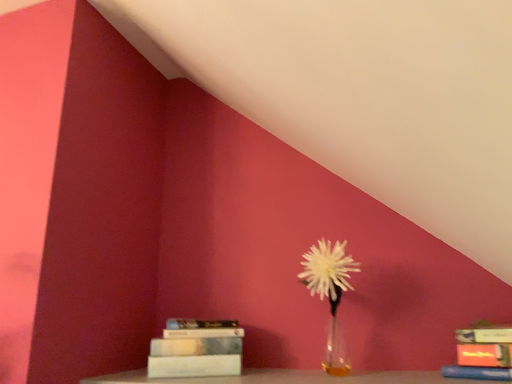
Find the location of a particular element. translucent glass vase at center is located at coordinates (288, 378).

This screenshot has width=512, height=384. What do you see at coordinates (330, 294) in the screenshot?
I see `white glass vase at center` at bounding box center [330, 294].

This screenshot has width=512, height=384. In order to click on white glass vase at center in this screenshot , I will do `click(330, 294)`.

What do you see at coordinates (482, 353) in the screenshot?
I see `hardcover book at lower right, acting as the second book starting from the back` at bounding box center [482, 353].

I want to click on hardcover book at lower right, marked as the 1th book in a front-to-back arrangement, so click(482, 353).

Image resolution: width=512 pixels, height=384 pixels. Find the location of `translucent glass vase at center`. translucent glass vase at center is located at coordinates (288, 378).

Is translucent glass vase at center aimed at hardcover book at lower right, acting as the second book starting from the back?

No, translucent glass vase at center is not turned towards hardcover book at lower right, acting as the second book starting from the back.

Considering the relative sizes of translucent glass vase at center and hardcover book at lower right, which is the second book from left to right, in the image provided, is translucent glass vase at center wider than hardcover book at lower right, which is the second book from left to right,?

Yes.

From the image's perspective, is translucent glass vase at center located above or below hardcover book at lower right, marked as the 1th book in a front-to-back arrangement?

translucent glass vase at center is situated lower than hardcover book at lower right, marked as the 1th book in a front-to-back arrangement, in the image.

Is translucent glass vase at center inside the boundaries of hardcover book at lower right, marked as the 1th book in a front-to-back arrangement, or outside?

translucent glass vase at center exists outside the volume of hardcover book at lower right, marked as the 1th book in a front-to-back arrangement.

From their relative heights in the image, would you say white glass vase at center is taller or shorter than translucent glass vase at center?

In the image, white glass vase at center appears to be taller than translucent glass vase at center.

Does white glass vase at center come behind translucent glass vase at center?

Yes, it is behind translucent glass vase at center.

From a real-world perspective, between white glass vase at center and translucent glass vase at center, who is vertically lower?

translucent glass vase at center, from a real-world perspective.

Measure the distance from hardcover book at lower right, which appears as the 1th book when viewed from the right, to translucent glass vase at center.

They are 7.74 inches apart.

Who is shorter, hardcover book at lower right, which is the second book from left to right, or translucent glass vase at center?

With less height is translucent glass vase at center.

From a real-world perspective, which is physically above, hardcover book at lower right, marked as the 1th book in a front-to-back arrangement, or translucent glass vase at center?

In real-world perspective, hardcover book at lower right, marked as the 1th book in a front-to-back arrangement, is above.

Based on their sizes in the image, would you say hardcover book at lower right, which appears as the 1th book when viewed from the right, is bigger or smaller than translucent glass vase at center?

Clearly, hardcover book at lower right, which appears as the 1th book when viewed from the right, is smaller in size than translucent glass vase at center.

Measure the distance between translucent glass vase at center and hardcover book at lower left, positioned as the second book in front-to-back order.

They are 4.84 inches apart.

Is translucent glass vase at center not within hardcover book at lower left, the first book from the left?

Indeed, translucent glass vase at center is completely outside hardcover book at lower left, the first book from the left.

Which of these two, translucent glass vase at center or hardcover book at lower left, the 2th book from the right, is bigger?

translucent glass vase at center.

Locate an element on the screen. furniture below the hardcover book at lower left, the 1th book positioned from the back (from the image's perspective) is located at coordinates (288, 378).

From the image's perspective, which is above, translucent glass vase at center or white glass vase at center?

white glass vase at center, from the image's perspective.

Can we say translucent glass vase at center lies outside white glass vase at center?

That's correct, translucent glass vase at center is outside of white glass vase at center.

Is translucent glass vase at center oriented away from white glass vase at center?

No.

Can you tell me how much translucent glass vase at center and white glass vase at center differ in facing direction?

The angular difference between translucent glass vase at center and white glass vase at center is 1.06 degrees.

Who is bigger, hardcover book at lower left, positioned as the second book in front-to-back order, or translucent glass vase at center?

With larger size is translucent glass vase at center.

Would you say hardcover book at lower left, the first book from the left, is inside or outside translucent glass vase at center?

hardcover book at lower left, the first book from the left, is not enclosed by translucent glass vase at center.

Can you confirm if hardcover book at lower left, positioned as the second book in front-to-back order, is shorter than translucent glass vase at center?

In fact, hardcover book at lower left, positioned as the second book in front-to-back order, may be taller than translucent glass vase at center.

Which object is closer to the camera, hardcover book at lower left, the 2th book from the right, or translucent glass vase at center?

translucent glass vase at center is closer to the camera.

From a real-world perspective, is hardcover book at lower left, the 1th book positioned from the back, positioned above or below hardcover book at lower right, which appears as the 1th book when viewed from the right?

From a real-world perspective, hardcover book at lower left, the 1th book positioned from the back, is physically above hardcover book at lower right, which appears as the 1th book when viewed from the right.

Are hardcover book at lower left, positioned as the second book in front-to-back order, and hardcover book at lower right, which appears as the 1th book when viewed from the right, beside each other?

They are not placed beside each other.

Which is in front, point (234, 321) or point (485, 350)?

The point (485, 350) is more forward.

Identify the location of furniture below the hardcover book at lower right, which appears as the 1th book when viewed from the right (from the image's perspective). The width and height of the screenshot is (512, 384). (288, 378).

Where is `floral arrangement that is on the right side of translucent glass vase at center`? The height and width of the screenshot is (384, 512). floral arrangement that is on the right side of translucent glass vase at center is located at coordinates (330, 294).

Which object lies further to the anchor point hardcover book at lower right, acting as the second book starting from the back, white glass vase at center or translucent glass vase at center?

white glass vase at center is positioned further to the anchor hardcover book at lower right, acting as the second book starting from the back.

Considering their positions, is hardcover book at lower left, the first book from the left, positioned closer to translucent glass vase at center than white glass vase at center?

hardcover book at lower left, the first book from the left, is positioned closer to the anchor translucent glass vase at center.

When comparing their distances from hardcover book at lower left, positioned as the second book in front-to-back order, does translucent glass vase at center or hardcover book at lower right, which appears as the 1th book when viewed from the right, seem further?

The object further to hardcover book at lower left, positioned as the second book in front-to-back order, is hardcover book at lower right, which appears as the 1th book when viewed from the right.

Based on their spatial positions, is white glass vase at center or hardcover book at lower right, marked as the 1th book in a front-to-back arrangement, closer to translucent glass vase at center?

hardcover book at lower right, marked as the 1th book in a front-to-back arrangement, is closer to translucent glass vase at center.

From the picture: Considering their positions, is white glass vase at center positioned closer to translucent glass vase at center than hardcover book at lower left, positioned as the second book in front-to-back order?

Based on the image, hardcover book at lower left, positioned as the second book in front-to-back order, appears to be nearer to translucent glass vase at center.

Looking at the image, which one is located further to white glass vase at center, hardcover book at lower right, which is the second book from left to right, or translucent glass vase at center?

Among the two, hardcover book at lower right, which is the second book from left to right, is located further to white glass vase at center.

Based on their spatial positions, is translucent glass vase at center or hardcover book at lower right, acting as the second book starting from the back, further from white glass vase at center?

hardcover book at lower right, acting as the second book starting from the back, is positioned further to the anchor white glass vase at center.

Looking at this image, considering their positions, is hardcover book at lower left, the 1th book positioned from the back, positioned closer to hardcover book at lower right, acting as the second book starting from the back, than white glass vase at center?

white glass vase at center is positioned closer to the anchor hardcover book at lower right, acting as the second book starting from the back.

I want to click on floral arrangement situated between translucent glass vase at center and hardcover book at lower right, marked as the 1th book in a front-to-back arrangement, from left to right, so click(330, 294).

I want to click on furniture between hardcover book at lower left, the 2th book from the right, and white glass vase at center, so click(288, 378).

Where is `furniture between hardcover book at lower left, the 1th book positioned from the back, and hardcover book at lower right, marked as the 1th book in a front-to-back arrangement`? furniture between hardcover book at lower left, the 1th book positioned from the back, and hardcover book at lower right, marked as the 1th book in a front-to-back arrangement is located at coordinates (288, 378).

In order to click on floral arrangement located between hardcover book at lower left, the 1th book positioned from the back, and hardcover book at lower right, marked as the 1th book in a front-to-back arrangement, in the left-right direction in this screenshot , I will do `click(330, 294)`.